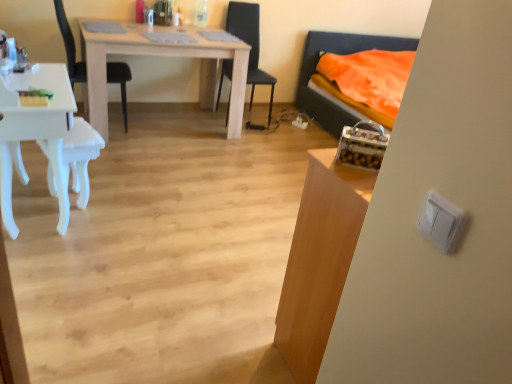
This screenshot has height=384, width=512. I want to click on free space to the left of white glossy switch at right, the second table from the back, so click(242, 337).